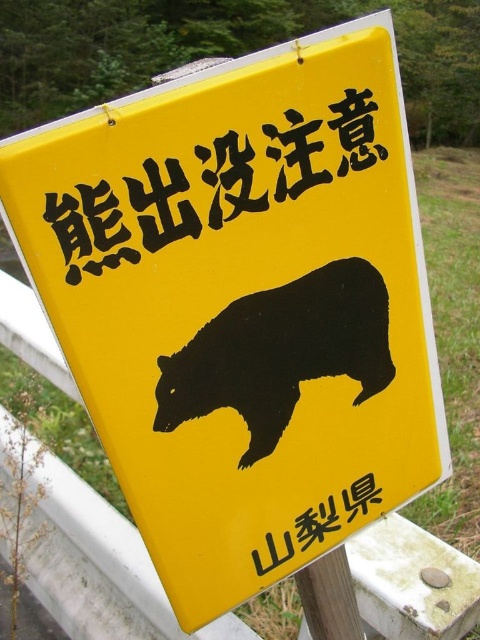
From the picture: You are standing in front of a yellow warning sign about bears near a forest. The sign has coordinates marked as point (338, 337). If you want to place a small sticker exactly 34.42 inches away from that point on the sign, where would you place it relative to the bear silhouette?

The distance between point (338, 337) and the viewer is 34.42 inches, so placing the sticker exactly at that point on the sign would be 34.42 inches away from the viewer. However, the question asks where on the sign relative to the bear silhouette. Since the bear silhouette is at the bottom of the sign, placing the sticker at point (338, 337) would be above the bear silhouette.